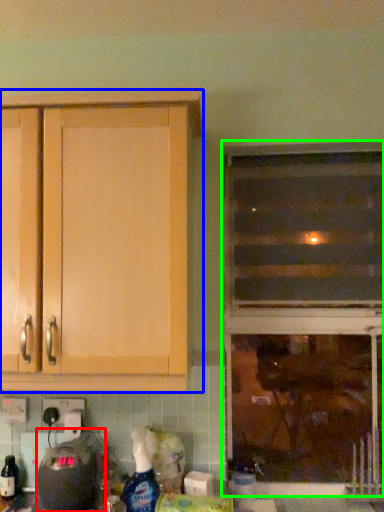
Question: Estimate the real-world distances between objects in this image. Which object is closer to appliance (highlighted by a red box), cabinetry (highlighted by a blue box) or window (highlighted by a green box)?

Choices:
 (A) cabinetry
 (B) window

Answer: (A)